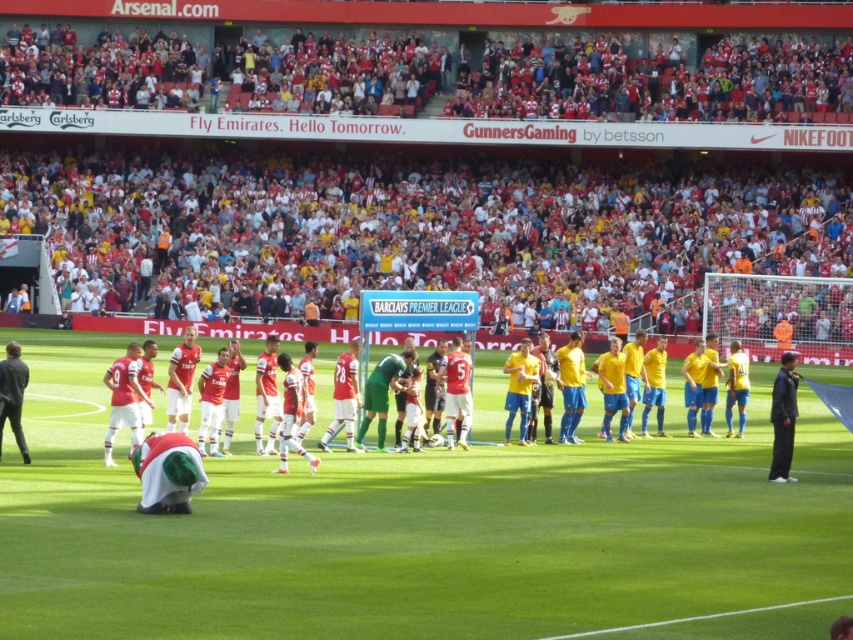
Question: Which is farther from the green grass field at center?

Choices:
 (A) dark gray suit at left
 (B) dark gray jacket at right
 (C) matte red jersey at center

Answer: (B)

Question: Which of these objects is positioned closest to the dark gray jacket at right?

Choices:
 (A) red fabric crowd at upper center
 (B) green grass field at center
 (C) dark gray suit at left
 (D) matte red jersey at center

Answer: (B)

Question: Can you confirm if dark gray jacket at right is thinner than dark gray suit at left?

Choices:
 (A) no
 (B) yes

Answer: (B)

Question: Among these objects, which one is farthest from the camera?

Choices:
 (A) dark gray suit at left
 (B) matte red jersey at center
 (C) red fabric crowd at upper center
 (D) green grass field at center

Answer: (C)

Question: Is green grass field at center thinner than red fabric crowd at upper center?

Choices:
 (A) yes
 (B) no

Answer: (A)

Question: Is matte red jersey at center bigger than dark gray jacket at right?

Choices:
 (A) yes
 (B) no

Answer: (A)